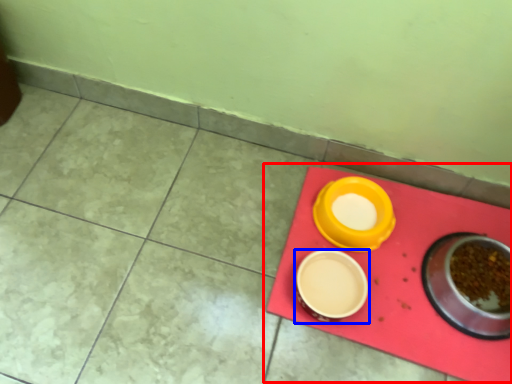
Question: Which of the following is the closest to the observer, table (highlighted by a red box) or tableware (highlighted by a blue box)?

Choices:
 (A) table
 (B) tableware

Answer: (A)